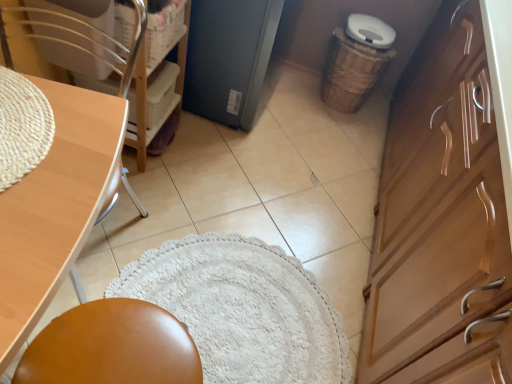
Find the location of a particular element. Image resolution: width=512 pixels, height=384 pixels. unoccupied region to the right of woven brown basket at right, which is counted as the 2th basket, starting from the front is located at coordinates (375, 119).